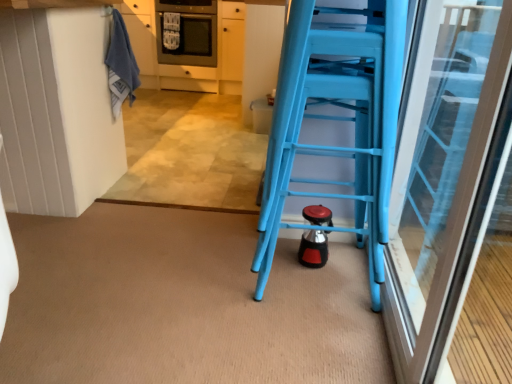
Identify the location of blue plastic ladder at right. (325, 119).

What is the approximate width of satin black oven at upper center?

satin black oven at upper center is 25.35 inches in width.

Where is `blue plastic ladder at right`? Image resolution: width=512 pixels, height=384 pixels. blue plastic ladder at right is located at coordinates (325, 119).

Can you confirm if white matte cabinetry at upper left is positioned to the right of blue plastic ladder at right?

No, white matte cabinetry at upper left is not to the right of blue plastic ladder at right.

Considering the sizes of objects white matte cabinetry at upper left and blue plastic ladder at right in the image provided, who is wider, white matte cabinetry at upper left or blue plastic ladder at right?

white matte cabinetry at upper left is wider.

Does white matte cabinetry at upper left have a greater height compared to blue plastic ladder at right?

No, white matte cabinetry at upper left is not taller than blue plastic ladder at right.

Between white matte cabinetry at upper left and blue plastic ladder at right, which one has larger size?

Bigger between the two is white matte cabinetry at upper left.

Can satin black oven at upper center be found inside blue towel at upper left?

Definitely not — satin black oven at upper center is not inside blue towel at upper left.

From a real-world perspective, who is located lower, blue towel at upper left or satin black oven at upper center?

satin black oven at upper center, from a real-world perspective.

How different are the orientations of blue towel at upper left and satin black oven at upper center in degrees?

They differ by 179 degrees in their facing directions.

Is satin black oven at upper center at the back of blue towel at upper left?

No, satin black oven at upper center is not at the back of blue towel at upper left.

Would you say satin black oven at upper center is a long distance from white matte cabinetry at upper left?

Actually, satin black oven at upper center and white matte cabinetry at upper left are a little close together.

From the image's perspective, between satin black oven at upper center and white matte cabinetry at upper left, which one is located above?

From the image's view, satin black oven at upper center is above.

Can you confirm if satin black oven at upper center is taller than white matte cabinetry at upper left?

In fact, satin black oven at upper center may be shorter than white matte cabinetry at upper left.

From a real-world perspective, is satin black oven at upper center on top of white matte cabinetry at upper left?

Correct, in the physical world, satin black oven at upper center is higher than white matte cabinetry at upper left.

Is point (131, 68) positioned in front of point (188, 69)?

That is True.

Is blue towel at upper left not near white matte cabinetry at upper left?

Yes, blue towel at upper left and white matte cabinetry at upper left are quite far apart.

Can we say blue towel at upper left lies outside white matte cabinetry at upper left?

Absolutely, blue towel at upper left is external to white matte cabinetry at upper left.

Between blue towel at upper left and white matte cabinetry at upper left, which one has larger width?

Wider between the two is white matte cabinetry at upper left.

From a real-world perspective, is blue plastic ladder at right beneath satin black oven at upper center?

Yes.

Which object is wider, blue plastic ladder at right or satin black oven at upper center?

Wider between the two is satin black oven at upper center.

Is blue plastic ladder at right bigger than satin black oven at upper center?

No.

Is blue plastic ladder at right spatially inside satin black oven at upper center, or outside of it?

blue plastic ladder at right is spatially situated outside satin black oven at upper center.

Are blue plastic ladder at right and white matte cabinetry at upper left beside each other?

No, blue plastic ladder at right is not in contact with white matte cabinetry at upper left.

Considering the sizes of blue plastic ladder at right and white matte cabinetry at upper left in the image, is blue plastic ladder at right wider or thinner than white matte cabinetry at upper left?

In the image, blue plastic ladder at right appears to be more narrow than white matte cabinetry at upper left.

From a real-world perspective, is blue plastic ladder at right physically located above or below white matte cabinetry at upper left?

In terms of real-world spatial position, blue plastic ladder at right is above white matte cabinetry at upper left.

Is blue towel at upper left placed right next to blue plastic ladder at right?

No, blue towel at upper left is not beside blue plastic ladder at right.

How many degrees apart are the facing directions of blue towel at upper left and blue plastic ladder at right?

They differ by 2.15 degrees in their facing directions.

This screenshot has height=384, width=512. I want to click on ladder below the blue towel at upper left (from the image's perspective), so click(325, 119).

Considering the sizes of objects blue towel at upper left and blue plastic ladder at right in the image provided, who is thinner, blue towel at upper left or blue plastic ladder at right?

With smaller width is blue towel at upper left.

You are a GUI agent. You are given a task and a screenshot of the screen. Output one action in this format:
    pyautogui.click(x=<x>, y=<y>)
    Task: Click on the ladder on the right of white matte cabinetry at upper left
    Image resolution: width=512 pixels, height=384 pixels.
    Given the screenshot: What is the action you would take?
    pyautogui.click(x=325, y=119)

This screenshot has height=384, width=512. I want to click on laundry on the left of the satin black oven at upper center, so click(x=121, y=65).

Looking at the image, which one is located further to satin black oven at upper center, blue towel at upper left or blue plastic ladder at right?

blue plastic ladder at right is positioned further to the anchor satin black oven at upper center.

Estimate the real-world distances between objects in this image. Which object is further from satin black oven at upper center, white matte cabinetry at upper left or blue plastic ladder at right?

Based on the image, blue plastic ladder at right appears to be further to satin black oven at upper center.

From the picture: Which object lies nearer to the anchor point white matte cabinetry at upper left, blue towel at upper left or satin black oven at upper center?

Based on the image, satin black oven at upper center appears to be nearer to white matte cabinetry at upper left.

Based on their spatial positions, is blue plastic ladder at right or white matte cabinetry at upper left further from satin black oven at upper center?

blue plastic ladder at right is positioned further to the anchor satin black oven at upper center.

Which object lies further to the anchor point white matte cabinetry at upper left, satin black oven at upper center or blue towel at upper left?

The object further to white matte cabinetry at upper left is blue towel at upper left.

From the image, which object appears to be farther from blue plastic ladder at right, white matte cabinetry at upper left or blue towel at upper left?

Among the two, white matte cabinetry at upper left is located further to blue plastic ladder at right.

When comparing their distances from blue towel at upper left, does satin black oven at upper center or white matte cabinetry at upper left seem further?

Based on the image, satin black oven at upper center appears to be further to blue towel at upper left.

Looking at the image, which one is located closer to white matte cabinetry at upper left, blue plastic ladder at right or satin black oven at upper center?

The object closer to white matte cabinetry at upper left is satin black oven at upper center.

Identify the location of laundry between blue plastic ladder at right and satin black oven at upper center in the front-back direction. (121, 65).

Locate an element on the screen. The width and height of the screenshot is (512, 384). oven between blue plastic ladder at right and white matte cabinetry at upper left in the front-back direction is located at coordinates (189, 32).

Where is `laundry between blue plastic ladder at right and white matte cabinetry at upper left from front to back`? This screenshot has height=384, width=512. laundry between blue plastic ladder at right and white matte cabinetry at upper left from front to back is located at coordinates 121,65.

At what (x,y) coordinates should I click in order to perform the action: click on oven between blue towel at upper left and white matte cabinetry at upper left from front to back. Please return your answer as a coordinate pair (x, y). Looking at the image, I should click on [x=189, y=32].